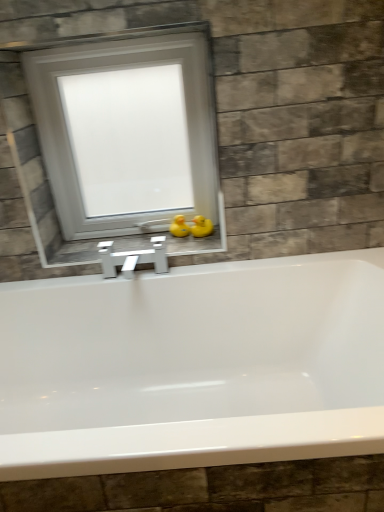
This screenshot has height=512, width=384. What do you see at coordinates (179, 227) in the screenshot? I see `yellow rubber duck at center, which is the first duck from left to right` at bounding box center [179, 227].

Find the location of a particular element. The width and height of the screenshot is (384, 512). yellow rubber duck at center, the second duck from the left is located at coordinates (201, 227).

The image size is (384, 512). I want to click on white glossy window sill at center, so click(x=175, y=238).

Identify the location of yellow rubber duck at center, which is the first duck from left to right. (179, 227).

Is yellow rubber duck at center, the second duck from the left, to the right of yellow rubber duck at center, which is the first duck from left to right, from the viewer's perspective?

Yes.

Is yellow rubber duck at center, the second duck from the left, taller or shorter than yellow rubber duck at center, the second duck viewed from the right?

Clearly, yellow rubber duck at center, the second duck from the left, is shorter compared to yellow rubber duck at center, the second duck viewed from the right.

Considering the positions of point (193, 229) and point (175, 219), is point (193, 229) closer or farther from the camera than point (175, 219)?

Point (193, 229) appears to be closer to the viewer than point (175, 219).

Considering their positions, is yellow rubber duck at center, the second duck from the left, located in front of or behind yellow rubber duck at center, the second duck viewed from the right?

Visually, yellow rubber duck at center, the second duck from the left, is located in front of yellow rubber duck at center, the second duck viewed from the right.

Is yellow rubber duck at center, the second duck from the left, not near white frosted glass window at upper center?

No, yellow rubber duck at center, the second duck from the left, is not far from white frosted glass window at upper center.

Find the location of a particular element. This screenshot has height=512, width=384. window on the left of yellow rubber duck at center, the first duck when ordered from right to left is located at coordinates (127, 131).

Is yellow rubber duck at center, the second duck from the left, positioned before white frosted glass window at upper center?

No, it is not.

From a real-world perspective, is white glossy window sill at center physically located above or below yellow rubber duck at center, the second duck from the left?

From a real-world perspective, white glossy window sill at center is physically below yellow rubber duck at center, the second duck from the left.

From the image's perspective, is white glossy window sill at center on top of yellow rubber duck at center, the first duck when ordered from right to left?

Actually, white glossy window sill at center appears below yellow rubber duck at center, the first duck when ordered from right to left, in the image.

Is white glossy window sill at center not near yellow rubber duck at center, the first duck when ordered from right to left?

Actually, white glossy window sill at center and yellow rubber duck at center, the first duck when ordered from right to left, are a little close together.

Based on the photo, is white glossy window sill at center in front of or behind yellow rubber duck at center, the second duck from the left, in the image?

white glossy window sill at center is in front of yellow rubber duck at center, the second duck from the left.

Is white frosted glass window at upper center outside of white glossy window sill at center?

Indeed, white frosted glass window at upper center is completely outside white glossy window sill at center.

Considering the points (65, 180) and (207, 243), which point is in front, point (65, 180) or point (207, 243)?

The point (65, 180) is in front.

Which of these two, white frosted glass window at upper center or white glossy window sill at center, is wider?

With larger width is white glossy window sill at center.

Is white frosted glass window at upper center far away from white glossy window sill at center?

No, white frosted glass window at upper center is not far from white glossy window sill at center.

From the image's perspective, is white frosted glass window at upper center located above or below yellow rubber duck at center, the second duck from the left?

white frosted glass window at upper center is situated higher than yellow rubber duck at center, the second duck from the left, in the image.

Which is farther, (x=67, y=218) or (x=192, y=231)?

The point (x=67, y=218) is behind.

Between white frosted glass window at upper center and yellow rubber duck at center, the second duck from the left, which one has larger width?

white frosted glass window at upper center is wider.

Does yellow rubber duck at center, the second duck viewed from the right, have a smaller size compared to yellow rubber duck at center, the first duck when ordered from right to left?

Yes.

Could you tell me if yellow rubber duck at center, the second duck viewed from the right, is turned towards yellow rubber duck at center, the second duck from the left?

No, yellow rubber duck at center, the second duck viewed from the right, is not facing towards yellow rubber duck at center, the second duck from the left.

Which is more to the right, yellow rubber duck at center, the second duck viewed from the right, or yellow rubber duck at center, the first duck when ordered from right to left?

Positioned to the right is yellow rubber duck at center, the first duck when ordered from right to left.

From the image's perspective, which is above, yellow rubber duck at center, which is the first duck from left to right, or yellow rubber duck at center, the first duck when ordered from right to left?

From the image's view, yellow rubber duck at center, which is the first duck from left to right, is above.

Between yellow rubber duck at center, the second duck viewed from the right, and white frosted glass window at upper center, which one is positioned behind?

yellow rubber duck at center, the second duck viewed from the right.

Between yellow rubber duck at center, which is the first duck from left to right, and white frosted glass window at upper center, which one has smaller size?

yellow rubber duck at center, which is the first duck from left to right.

From the picture: Does yellow rubber duck at center, which is the first duck from left to right, turn towards white frosted glass window at upper center?

No, yellow rubber duck at center, which is the first duck from left to right, is not turned towards white frosted glass window at upper center.

Is yellow rubber duck at center, which is the first duck from left to right, wider than white frosted glass window at upper center?

In fact, yellow rubber duck at center, which is the first duck from left to right, might be narrower than white frosted glass window at upper center.

Find the location of a particular element. The height and width of the screenshot is (512, 384). duck above the yellow rubber duck at center, which is the first duck from left to right (from a real-world perspective) is located at coordinates (201, 227).

Which duck is the 2nd one when counting from the right side of the white frosted glass window at upper center? Please provide its 2D coordinates.

[(201, 227)]

When comparing their distances from white frosted glass window at upper center, does yellow rubber duck at center, the second duck viewed from the right, or white glossy window sill at center seem closer?

white glossy window sill at center is closer to white frosted glass window at upper center.

Which object lies further to the anchor point yellow rubber duck at center, the second duck viewed from the right, white glossy window sill at center or yellow rubber duck at center, the first duck when ordered from right to left?

Based on the image, white glossy window sill at center appears to be further to yellow rubber duck at center, the second duck viewed from the right.

Which object lies nearer to the anchor point white glossy window sill at center, yellow rubber duck at center, the first duck when ordered from right to left, or yellow rubber duck at center, the second duck viewed from the right?

Among the two, yellow rubber duck at center, the second duck viewed from the right, is located nearer to white glossy window sill at center.

Looking at the image, which one is located closer to white glossy window sill at center, white frosted glass window at upper center or yellow rubber duck at center, the first duck when ordered from right to left?

yellow rubber duck at center, the first duck when ordered from right to left, is closer to white glossy window sill at center.

Based on their spatial positions, is white frosted glass window at upper center or white glossy window sill at center closer to yellow rubber duck at center, the second duck from the left?

white glossy window sill at center is closer to yellow rubber duck at center, the second duck from the left.

Which object lies further to the anchor point yellow rubber duck at center, the second duck viewed from the right, white frosted glass window at upper center or yellow rubber duck at center, the second duck from the left?

white frosted glass window at upper center lies further to yellow rubber duck at center, the second duck viewed from the right, than the other object.

From the image, which object appears to be farther from yellow rubber duck at center, the second duck from the left, white glossy window sill at center or white frosted glass window at upper center?

white frosted glass window at upper center is positioned further to the anchor yellow rubber duck at center, the second duck from the left.

Considering their positions, is white glossy window sill at center positioned further to white frosted glass window at upper center than yellow rubber duck at center, which is the first duck from left to right?

Among the two, yellow rubber duck at center, which is the first duck from left to right, is located further to white frosted glass window at upper center.

I want to click on duck between white frosted glass window at upper center and yellow rubber duck at center, the first duck when ordered from right to left, vertically, so click(x=179, y=227).

Identify the location of duck between white glossy window sill at center and yellow rubber duck at center, the second duck from the left, in the horizontal direction. The width and height of the screenshot is (384, 512). (179, 227).